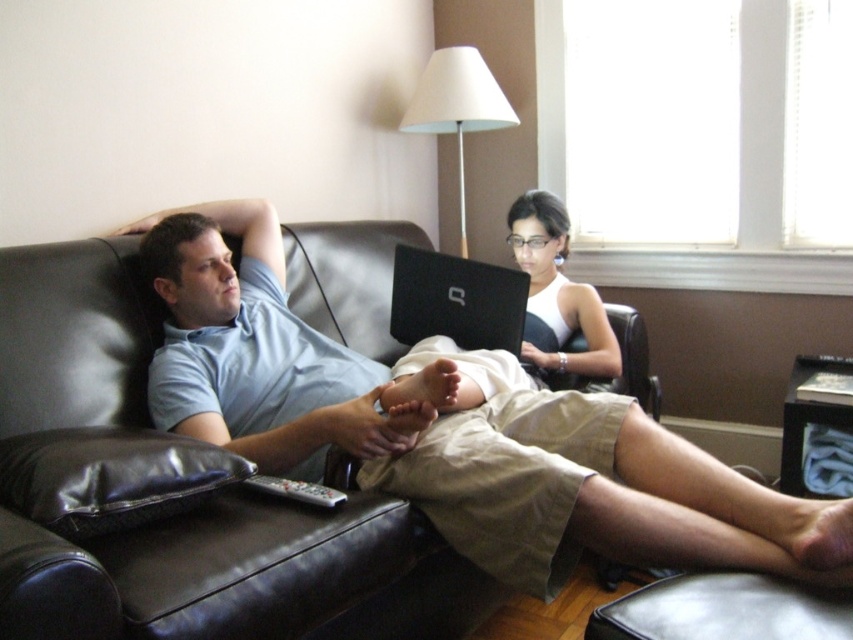
You are standing in the living room and want to place a small plant between the two points marked as point (x=404, y=321) and point (x=316, y=492). Which point should the plant be closer to in order to be centered between them?

The plant should be placed closer to point (x=316, y=492) because point (x=404, y=321) is further to the camera than point (x=316, y=492), so the midpoint between them would be closer to the nearer point.

You are a photographer setting up a shoot in this living room. You need to position a light source so that it illuminates the light blue cotton shirt at center and the gray plastic remote at lower center. Based on their positions, which object should be placed closer to the light source to ensure both receive equal illumination?

The light blue cotton shirt at center should be placed closer to the light source because it is positioned to the right of the gray plastic remote at lower center, so adjusting their distance from the light can balance the illumination between them.

Based on the photo, you are a photographer trying to capture a clear shot of the light blue cotton shirt at center and the gray plastic remote at lower center. Which object should you focus on first to ensure both are in focus?

The light blue cotton shirt at center is closer to the viewer than the gray plastic remote at lower center. To ensure both are in focus, you should focus on the gray plastic remote at lower center first, as it is farther away, and adjust the focus range to include the closer object.